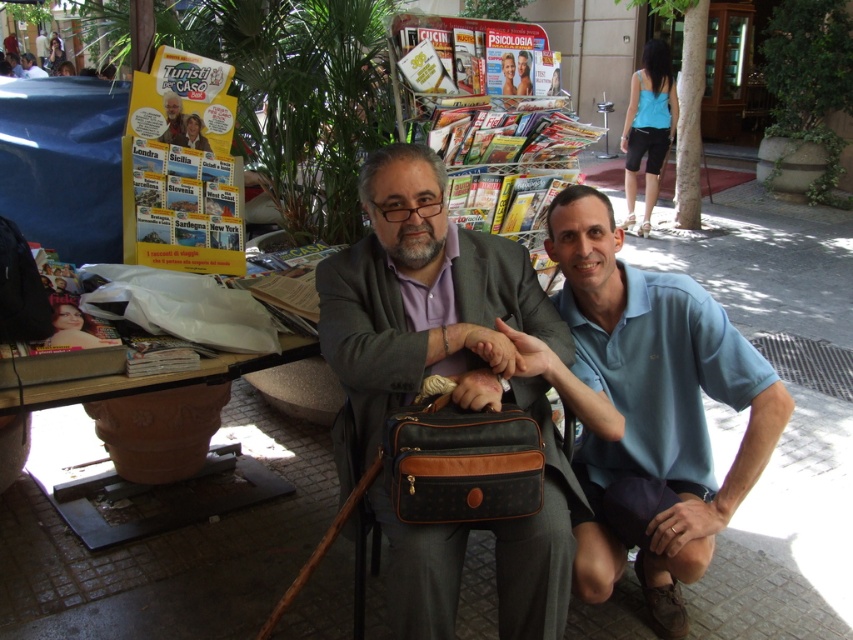
Question: Is leather bag at center below matte black bag at center?

Choices:
 (A) no
 (B) yes

Answer: (B)

Question: Based on their relative distances, which object is nearer to the brown textured briefcase at center?

Choices:
 (A) blue cotton shirt at lower right
 (B) matte black bag at center
 (C) matte black jacket at center
 (D) leather bag at center

Answer: (D)

Question: In this image, where is leather bag at center located relative to matte black bag at center?

Choices:
 (A) left
 (B) right

Answer: (B)

Question: Can you confirm if leather bag at center is smaller than matte black bag at center?

Choices:
 (A) no
 (B) yes

Answer: (B)

Question: Which object is the closest to the blue cotton shirt at lower right?

Choices:
 (A) matte black bag at center
 (B) brown textured briefcase at center

Answer: (B)

Question: Among these objects, which one is farthest from the camera?

Choices:
 (A) matte black bag at center
 (B) blue cotton shirt at lower right
 (C) brown textured briefcase at center
 (D) leather bag at center

Answer: (A)